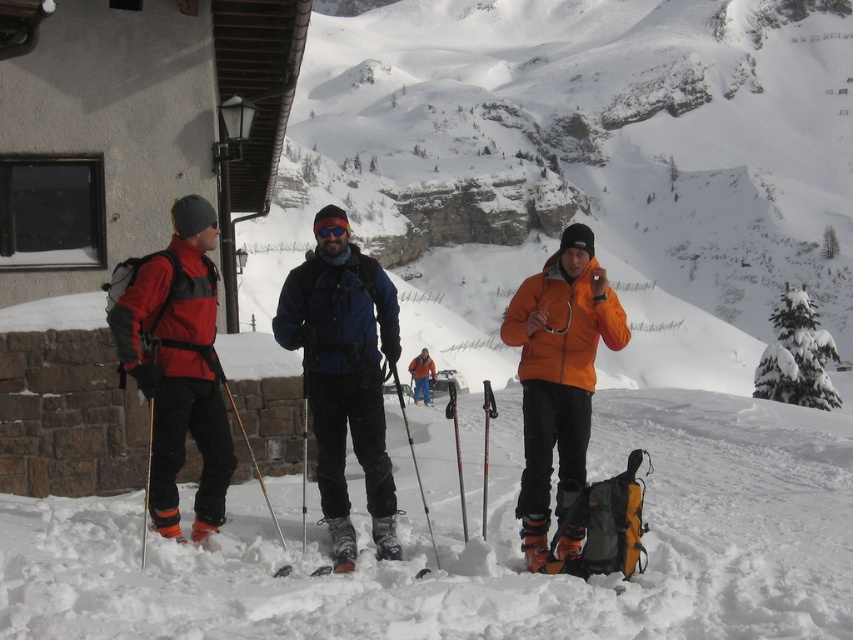
In the scene shown: You are planning to take a photo of the matte red jacket at left from the position of the person holding the phone. Based on the coordinates provided, will the jacket be in the frame if the camera has a standard 50mm lens?

The matte red jacket at left is located at point (178, 364), so yes, it will be within the frame as standard lenses typically capture a wide enough angle to include objects at those coordinates.